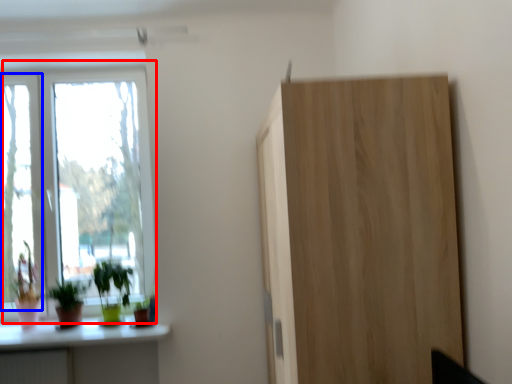
Question: Which of the following is the closest to the observer, window (highlighted by a red box) or window (highlighted by a blue box)?

Choices:
 (A) window
 (B) window

Answer: (B)